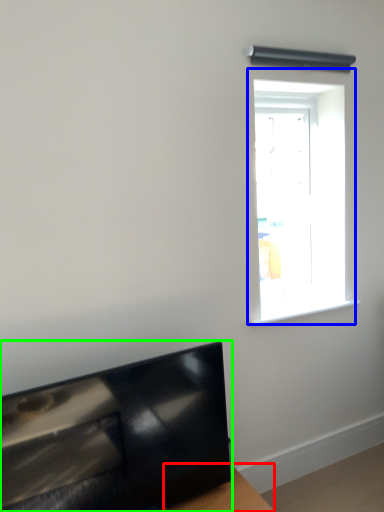
Question: Which is farther away from table (highlighted by a red box)? window (highlighted by a blue box) or furniture (highlighted by a green box)?

Choices:
 (A) window
 (B) furniture

Answer: (A)